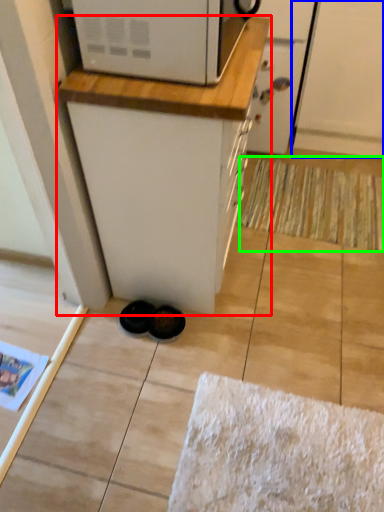
Question: Based on their relative distances, which object is farther from cabinetry (highlighted by a red box)? Choose from screen door (highlighted by a blue box) and doormat (highlighted by a green box).

Choices:
 (A) screen door
 (B) doormat

Answer: (A)